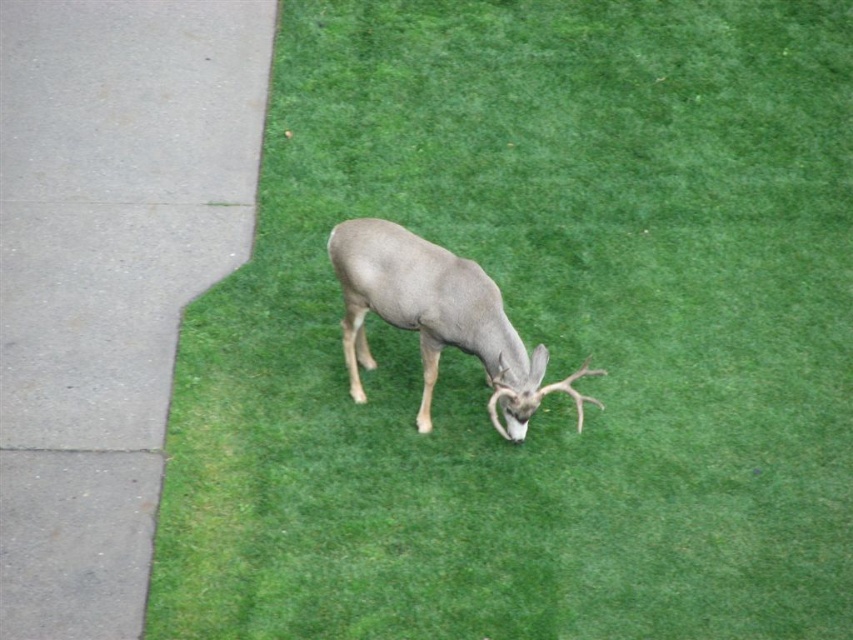
Question: Is gray concrete pavement at left closer to the viewer compared to gray matte deer at center?

Choices:
 (A) yes
 (B) no

Answer: (A)

Question: Which point is farther from the camera taking this photo?

Choices:
 (A) (67, 164)
 (B) (422, 356)

Answer: (A)

Question: Where is gray concrete pavement at left located in relation to gray matte deer at center in the image?

Choices:
 (A) right
 (B) left

Answer: (B)

Question: Where is gray concrete pavement at left located in relation to gray matte deer at center in the image?

Choices:
 (A) below
 (B) above

Answer: (B)